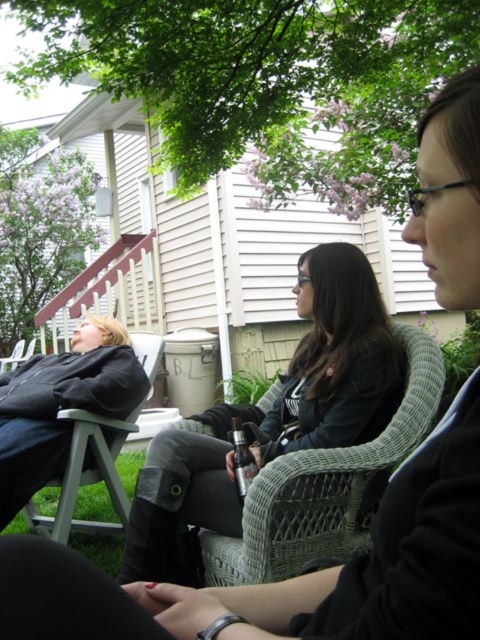
You are standing in the backyard and want to place a small potted plant between the two points labeled as point (316,557) and point (148,301). Which point should the plant be closer to if you want it to be nearer to the camera?

The plant should be placed closer to point (316,557) because it is closer to the camera than point (148,301).

You are planning to place a new rectangular table that is 1.5 meters wide between the wooden porch at upper left and the matte black chair at left. Based on their widths, will the table fit between them?

The wooden porch at upper left is wider than the matte black chair at left. Since the table is 1.5 meters wide, but the exact widths of the objects aren not provided, it is impossible to determine if the table will fit between them.

What object is located at the coordinates point [108,291]?

The wooden porch at upper left is located at point [108,291].